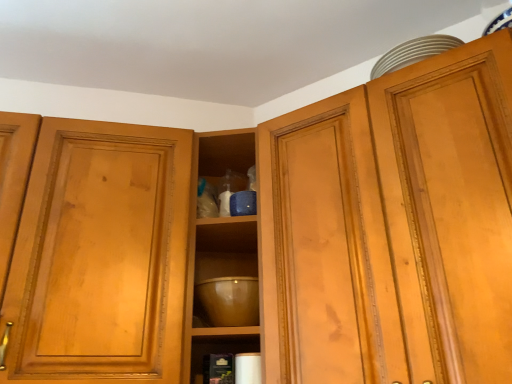
Question: Are matte wood cabinet at upper right and glossy ceramic mixing bowl at center far apart?

Choices:
 (A) no
 (B) yes

Answer: (A)

Question: From the image's perspective, is matte wood cabinet at upper right under glossy ceramic mixing bowl at center?

Choices:
 (A) no
 (B) yes

Answer: (A)

Question: Considering the relative positions of matte wood cabinet at upper right and glossy ceramic mixing bowl at center in the image provided, is matte wood cabinet at upper right in front of glossy ceramic mixing bowl at center?

Choices:
 (A) no
 (B) yes

Answer: (B)

Question: Is matte wood cabinet at upper right wider than glossy ceramic mixing bowl at center?

Choices:
 (A) no
 (B) yes

Answer: (B)

Question: Is matte wood cabinet at upper right completely or partially outside of glossy ceramic mixing bowl at center?

Choices:
 (A) no
 (B) yes

Answer: (B)

Question: Considering the relative positions of matte wood cabinet at upper right and glossy ceramic mixing bowl at center in the image provided, is matte wood cabinet at upper right behind glossy ceramic mixing bowl at center?

Choices:
 (A) yes
 (B) no

Answer: (B)

Question: From the image's perspective, is transparent glass cabinet at upper center over matte wood cabinet at upper right?

Choices:
 (A) yes
 (B) no

Answer: (B)

Question: From the image's perspective, does transparent glass cabinet at upper center appear lower than matte wood cabinet at upper right?

Choices:
 (A) yes
 (B) no

Answer: (A)

Question: Considering the relative sizes of transparent glass cabinet at upper center and matte wood cabinet at upper right in the image provided, is transparent glass cabinet at upper center smaller than matte wood cabinet at upper right?

Choices:
 (A) no
 (B) yes

Answer: (B)

Question: Does transparent glass cabinet at upper center have a larger size compared to matte wood cabinet at upper right?

Choices:
 (A) yes
 (B) no

Answer: (B)

Question: Is matte wood cabinet at upper right located within transparent glass cabinet at upper center?

Choices:
 (A) no
 (B) yes

Answer: (A)

Question: Is transparent glass cabinet at upper center completely or partially outside of matte wood cabinet at upper right?

Choices:
 (A) no
 (B) yes

Answer: (B)

Question: Is transparent glass cabinet at upper center smaller than glossy ceramic mixing bowl at center?

Choices:
 (A) no
 (B) yes

Answer: (A)